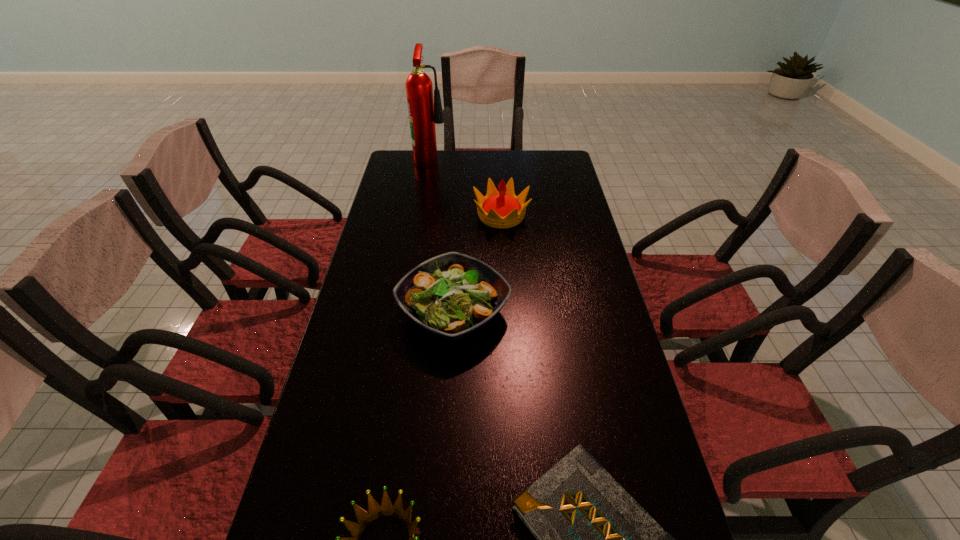
The width and height of the screenshot is (960, 540). What are the coordinates of `fire extinguisher` in the screenshot? It's located at (424, 112).

Find the location of a particular element. The height and width of the screenshot is (540, 960). the tallest object is located at coordinates (424, 112).

Where is `the right crown`? the right crown is located at coordinates tap(503, 209).

You are a GUI agent. You are given a task and a screenshot of the screen. Output one action in this format:
    pyautogui.click(x=<x>, y=<y>)
    Task: Click on the second farthest object
    The width and height of the screenshot is (960, 540).
    Given the screenshot: What is the action you would take?
    pyautogui.click(x=503, y=209)

Where is `salad plate`? The height and width of the screenshot is (540, 960). salad plate is located at coordinates (453, 295).

In order to click on the third tallest object in this screenshot , I will do `click(453, 295)`.

Locate an element on the screen. This screenshot has height=540, width=960. free location located 0.150m at the nozzle of the tallest object is located at coordinates (483, 159).

Image resolution: width=960 pixels, height=540 pixels. In order to click on blank area located on the front of the taller crown in this screenshot , I will do `click(506, 300)`.

At what (x,y) coordinates should I click in order to perform the action: click on vacant space located 0.160m on the right of the third farthest object. Please return your answer as a coordinate pair (x, y). Looking at the image, I should click on (567, 312).

Where is `object positioned at the far edge`? The height and width of the screenshot is (540, 960). object positioned at the far edge is located at coordinates (424, 112).